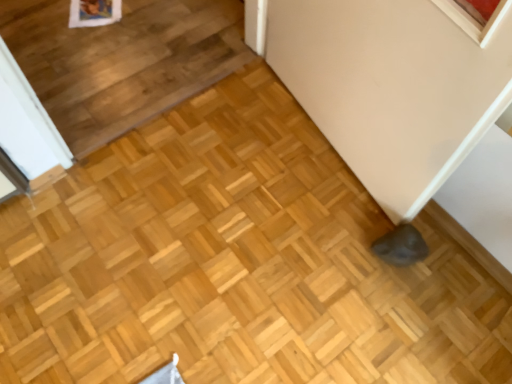
Where is `free spot to the left of white matte door at lower right`? This screenshot has width=512, height=384. free spot to the left of white matte door at lower right is located at coordinates (172, 182).